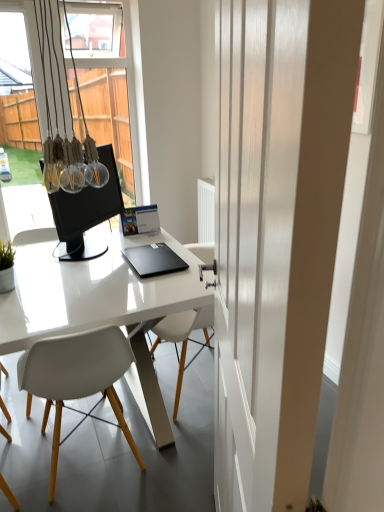
Identify the location of free spot in front of black matte laptop at center. (138, 284).